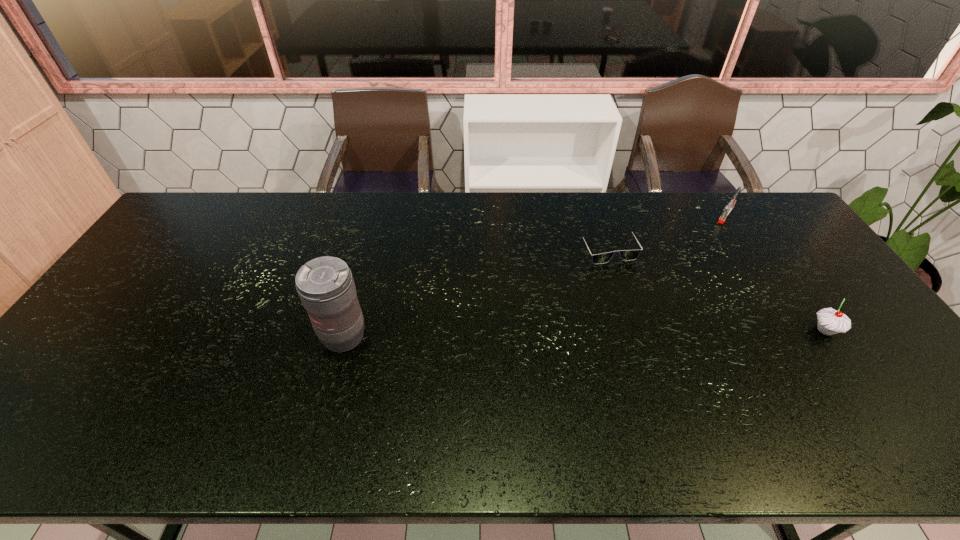
Where is `free space on the desktop that is between the tallest object and the third shortest object and is positioned on the handle side of the farthest object`? This screenshot has height=540, width=960. free space on the desktop that is between the tallest object and the third shortest object and is positioned on the handle side of the farthest object is located at coordinates (641, 333).

At what (x,y) coordinates should I click in order to perform the action: click on vacant spot on the desktop that is between the telephoto lens and the cupcake and is positioned on the front-facing side of the second object from left to right. Please return your answer as a coordinate pair (x, y). This screenshot has width=960, height=540. Looking at the image, I should click on (654, 333).